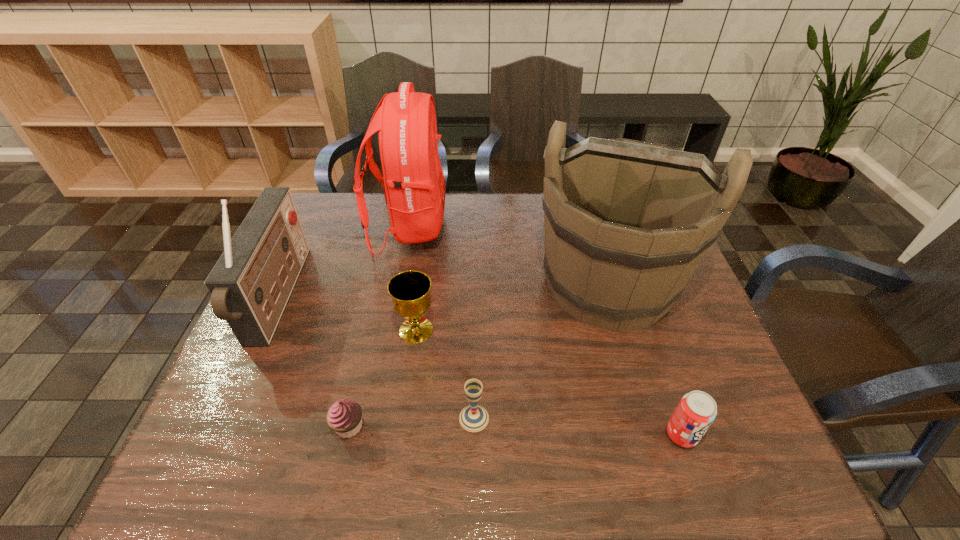
Where is `vacant space at the near right corner of the desktop`? vacant space at the near right corner of the desktop is located at coordinates [770, 455].

You are a GUI agent. You are given a task and a screenshot of the screen. Output one action in this format:
    pyautogui.click(x=<x>, y=<y>)
    Task: Click on the empty location between the shorter chalice and the radio receiver
    
    Given the screenshot: What is the action you would take?
    pyautogui.click(x=376, y=358)

The height and width of the screenshot is (540, 960). In order to click on vacant area that lies between the backpack and the shortest object in this screenshot , I will do `click(379, 327)`.

Identify the location of free space between the cupcake and the third tallest object. (314, 362).

Where is `free space between the soda can and the nearer chalice`? free space between the soda can and the nearer chalice is located at coordinates (578, 427).

Find the location of a particular element. vacant space that's between the farther chalice and the radio receiver is located at coordinates (348, 314).

Identify the location of vacant region between the shortest object and the soda can. (x=516, y=430).

Find the location of a particular element. This screenshot has width=960, height=540. vacant region between the shortest object and the radio receiver is located at coordinates (314, 362).

The height and width of the screenshot is (540, 960). What are the coordinates of `vacant space in between the shortest object and the radio receiver` in the screenshot? It's located at (314, 362).

Find the location of a particular element. The height and width of the screenshot is (540, 960). free space between the left chalice and the cupcake is located at coordinates [x=382, y=379].